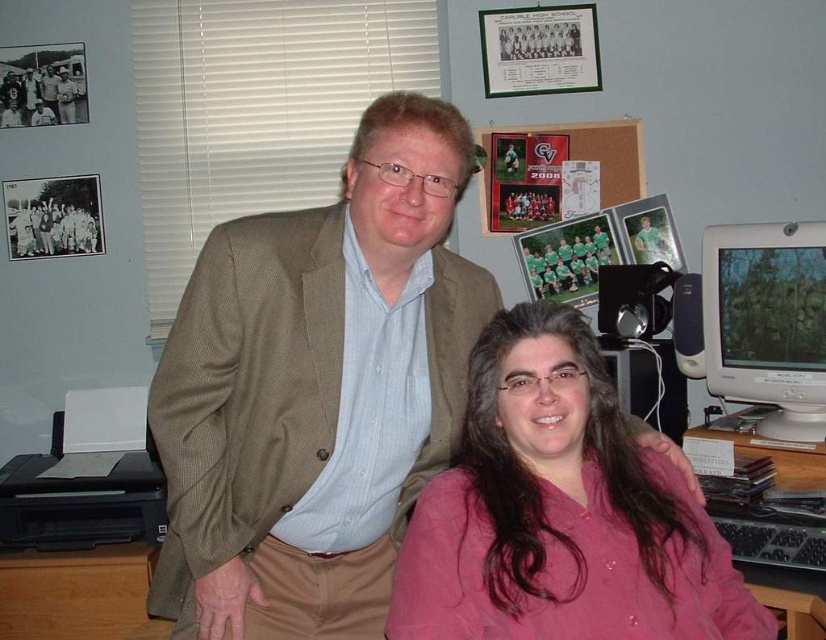
You are a technician who needs to adjust the height of the matte white monitor at right. The recommended viewing distance is between 20 to 28 inches. Is the current distance within the recommended range?

The distance between the matte white monitor at right and the camera is 6.12 feet, which converts to approximately 73.44 inches. Since the recommended range is 20 to 28 inches, the current distance is outside the recommended range and too far.

You are an interior designer observing the scene. You need to hang a picture frame that is 1 meter tall. The frame must be placed above an object in the scene. Which object between the pink matte shirt at center and the brown wooden table at lower left would you choose to place the frame above?

The pink matte shirt at center is much taller than the brown wooden table at lower left, so the frame should be placed above the pink matte shirt at center to ensure it is tall enough to accommodate the frame.

You are organizing a presentation and need to place a 14 inch laptop on the desk. Considering the size of the matte white monitor at right and the brown wooden table at lower left, which object has enough space to accommodate the laptop?

The brown wooden table at lower left has enough space to accommodate the 14 inch laptop since it has a greater width than the matte white monitor at right.